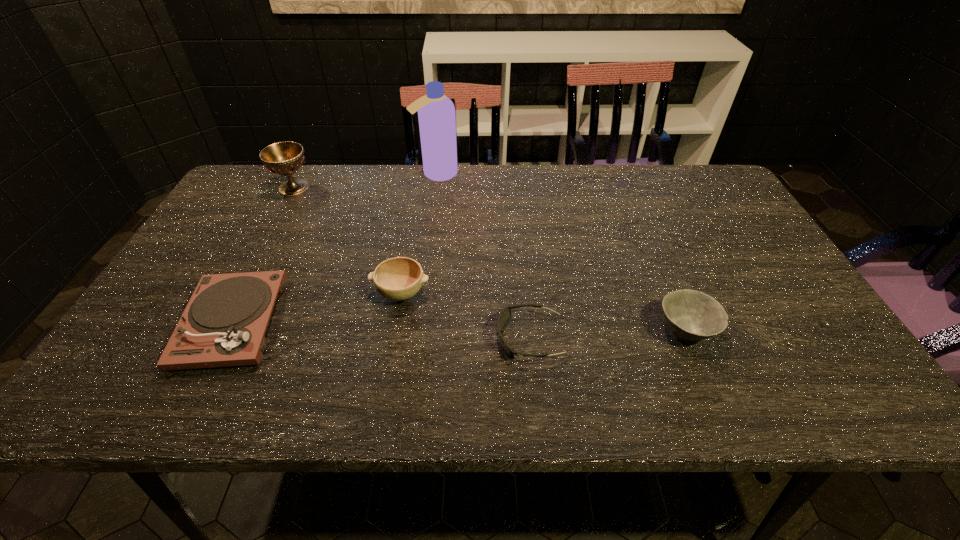
Locate an element on the screen. This screenshot has width=960, height=540. vacant area between the left bowl and the phonograph_record is located at coordinates (317, 308).

You are a GUI agent. You are given a task and a screenshot of the screen. Output one action in this format:
    pyautogui.click(x=<x>, y=<y>)
    Task: Click on the free space between the shortest object and the left bowl
    This screenshot has width=960, height=540.
    Given the screenshot: What is the action you would take?
    (x=466, y=316)

I want to click on vacant area that lies between the left bowl and the rightmost object, so click(x=543, y=312).

You are a GUI agent. You are given a task and a screenshot of the screen. Output one action in this format:
    pyautogui.click(x=<x>, y=<y>)
    Task: Click on the vacant region between the shampoo and the rightmost object
    
    Given the screenshot: What is the action you would take?
    pyautogui.click(x=561, y=252)

The width and height of the screenshot is (960, 540). I want to click on free space between the left bowl and the phonograph_record, so click(x=317, y=308).

You are a GUI agent. You are given a task and a screenshot of the screen. Output one action in this format:
    pyautogui.click(x=<x>, y=<y>)
    Task: Click on the blank region between the goggles and the phonograph_record
    The height and width of the screenshot is (540, 960).
    Given the screenshot: What is the action you would take?
    pyautogui.click(x=381, y=330)

I want to click on free space between the fifth shortest object and the phonograph_record, so click(x=263, y=255).

Select which object is the second closest to the phonograph_record. Please provide its 2D coordinates. Your answer should be formatted as a tuple, i.e. [(x, y)], where the tuple contains the x and y coordinates of a point satisfying the conditions above.

[(284, 158)]

Identify which object is the second closest to the left bowl. Please provide its 2D coordinates. Your answer should be formatted as a tuple, i.e. [(x, y)], where the tuple contains the x and y coordinates of a point satisfying the conditions above.

[(224, 323)]

Image resolution: width=960 pixels, height=540 pixels. Find the location of `vacant position in the image that satisfies the following two spatial constraints: 1. on the front side of the right bowl; 2. on the left side of the shampoo`. vacant position in the image that satisfies the following two spatial constraints: 1. on the front side of the right bowl; 2. on the left side of the shampoo is located at coordinates (417, 330).